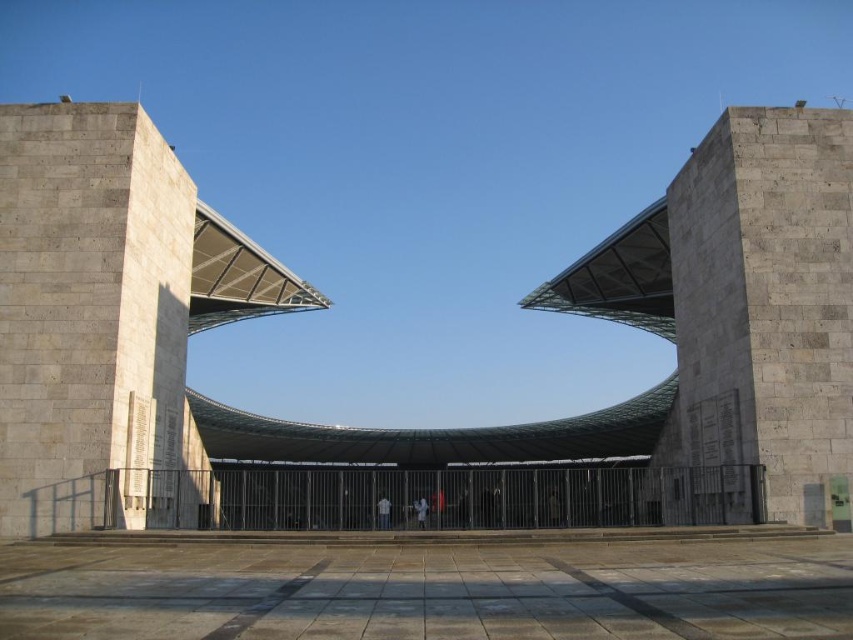
You are an architect analyzing the building layout. You need to determine the spatial relationship between the gray stone arch at center and the gray stone pillar at right. Which object is located to the left of the other?

The gray stone arch at center is positioned on the left side of gray stone pillar at right, meaning the arch is to the left of the pillar.

You are an architect designing a new building and want to incorporate elements from this image. If you need to place a decorative element between the gray stone arch at center and the gray stone pillar at right, which one should you place it closer to to ensure it fits within the available space?

The gray stone arch at center might be wider than the gray stone pillar at right, so placing the decorative element closer to the gray stone pillar at right would ensure it fits within the available space.

You are an architect designing a new pathway between the gray stone arch at center and the gray stone pillar at right. The pathway must be exactly 20 meters long. Will the pathway fit between them without needing adjustments?

The distance between the gray stone arch at center and the gray stone pillar at right is 20.46 meters. Since the pathway is only 20 meters long, it will be 0.46 meters shorter than the required distance. Therefore, adjustments would be needed to either extend the pathway or reduce the gap between them to ensure proper placement.